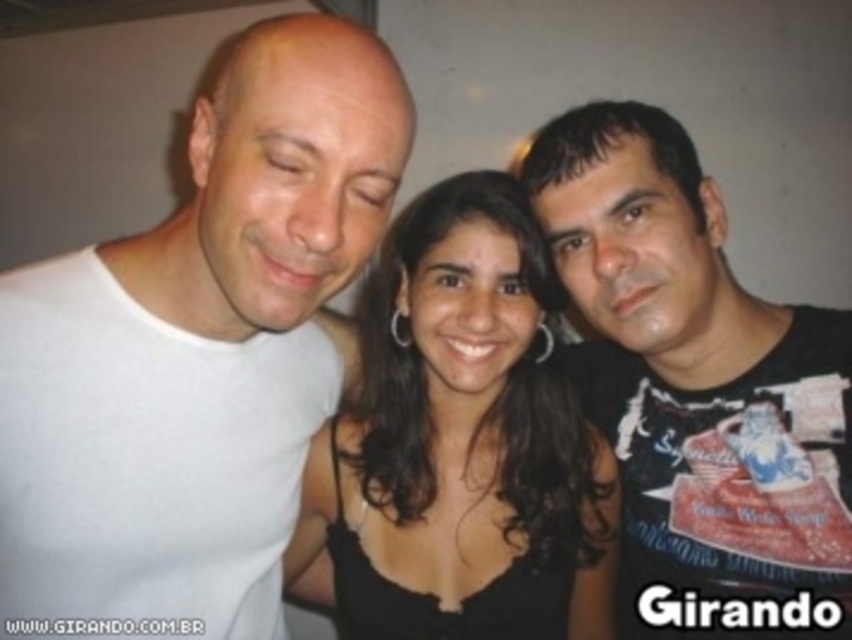
Looking at this image, can you confirm if black printed t-shirt at center is taller than black matte dress at center?

Yes, black printed t-shirt at center is taller than black matte dress at center.

Can you confirm if black printed t-shirt at center is positioned above black matte dress at center?

Yes.

Between point (843, 557) and point (469, 605), which one is positioned in front?

Point (843, 557) is in front.

Locate an element on the screen. The width and height of the screenshot is (852, 640). black printed t-shirt at center is located at coordinates (698, 388).

Which is above, white matte t-shirt at left or black matte dress at center?

white matte t-shirt at left

Is white matte t-shirt at left further to camera compared to black matte dress at center?

That is False.

The width and height of the screenshot is (852, 640). What are the coordinates of `white matte t-shirt at left` in the screenshot? It's located at (196, 355).

Locate an element on the screen. white matte t-shirt at left is located at coordinates (196, 355).

Can you confirm if white matte t-shirt at left is positioned to the left of black printed t-shirt at center?

Yes, white matte t-shirt at left is to the left of black printed t-shirt at center.

Who is more distant from viewer, [306,408] or [672,612]?

Point [672,612]

What do you see at coordinates (196, 355) in the screenshot? This screenshot has height=640, width=852. I see `white matte t-shirt at left` at bounding box center [196, 355].

In order to click on white matte t-shirt at left in this screenshot , I will do `click(196, 355)`.